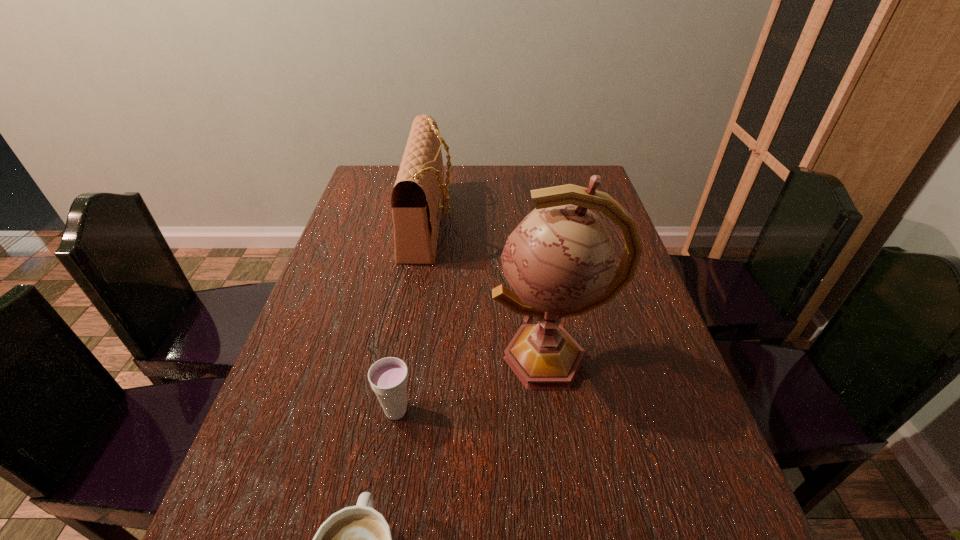
The height and width of the screenshot is (540, 960). I want to click on free space between the cup and the third shortest object, so click(413, 317).

Identify the location of free spot between the cup and the third shortest object. (413, 317).

Locate an element on the screen. Image resolution: width=960 pixels, height=540 pixels. empty location between the handbag and the cup is located at coordinates (413, 317).

The height and width of the screenshot is (540, 960). I want to click on vacant space that's between the handbag and the tallest object, so click(x=490, y=290).

Identify the location of object that is the third closest to the cup. This screenshot has height=540, width=960. (416, 201).

Identify the location of object that stands as the closest to the cup. (357, 539).